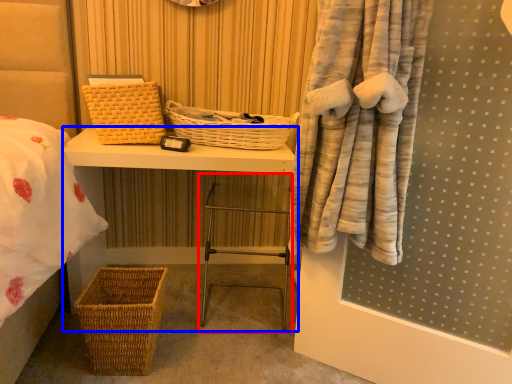
Question: Which of the following is the closest to the observer, step stool (highlighted by a red box) or furniture (highlighted by a blue box)?

Choices:
 (A) step stool
 (B) furniture

Answer: (B)